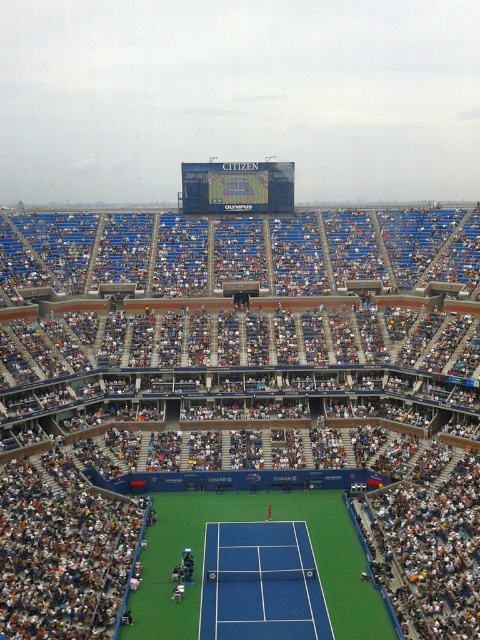
Question: Is blue synthetic turf tennis court at center below blue synthetic turf at center?

Choices:
 (A) no
 (B) yes

Answer: (B)

Question: Does blue synthetic turf tennis court at center appear on the right side of blue synthetic turf at center?

Choices:
 (A) yes
 (B) no

Answer: (A)

Question: Is blue synthetic turf tennis court at center thinner than blue synthetic turf at center?

Choices:
 (A) yes
 (B) no

Answer: (A)

Question: Which point appears closest to the camera in this image?

Choices:
 (A) (192, 593)
 (B) (287, 637)

Answer: (B)

Question: Which point is farther to the camera?

Choices:
 (A) blue synthetic turf at center
 (B) blue synthetic turf tennis court at center

Answer: (A)